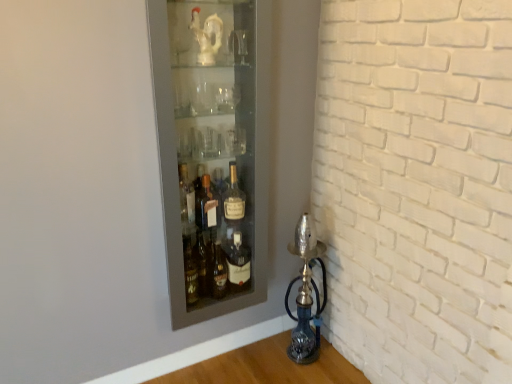
Question: Can you confirm if matte glass bottle at center is positioned to the left of matte glass cabinet at upper left?

Choices:
 (A) yes
 (B) no

Answer: (B)

Question: Is matte glass bottle at center positioned before matte glass cabinet at upper left?

Choices:
 (A) no
 (B) yes

Answer: (A)

Question: Does matte glass bottle at center have a lesser height compared to matte glass cabinet at upper left?

Choices:
 (A) yes
 (B) no

Answer: (A)

Question: Is matte glass cabinet at upper left a part of matte glass bottle at center?

Choices:
 (A) no
 (B) yes

Answer: (A)

Question: From the image's perspective, would you say matte glass bottle at center is positioned over matte glass cabinet at upper left?

Choices:
 (A) no
 (B) yes

Answer: (A)

Question: Is point (295, 230) closer or farther from the camera than point (237, 203)?

Choices:
 (A) farther
 (B) closer

Answer: (A)

Question: From a real-world perspective, relative to matte glass bottle at center, is blue glass oil lamp at lower right vertically above or below?

Choices:
 (A) above
 (B) below

Answer: (B)

Question: Considering the relative positions of blue glass oil lamp at lower right and matte glass bottle at center in the image provided, is blue glass oil lamp at lower right to the left or to the right of matte glass bottle at center?

Choices:
 (A) left
 (B) right

Answer: (B)

Question: Is blue glass oil lamp at lower right inside the boundaries of matte glass bottle at center, or outside?

Choices:
 (A) inside
 (B) outside

Answer: (B)

Question: Relative to blue glass oil lamp at lower right, is matte glass cabinet at upper left in front or behind?

Choices:
 (A) behind
 (B) front

Answer: (B)

Question: Considering the positions of matte glass cabinet at upper left and blue glass oil lamp at lower right in the image, is matte glass cabinet at upper left taller or shorter than blue glass oil lamp at lower right?

Choices:
 (A) tall
 (B) short

Answer: (A)

Question: Is matte glass cabinet at upper left wider or thinner than blue glass oil lamp at lower right?

Choices:
 (A) thin
 (B) wide

Answer: (A)

Question: In the image, is matte glass cabinet at upper left on the left side or the right side of blue glass oil lamp at lower right?

Choices:
 (A) left
 (B) right

Answer: (A)

Question: From the image's perspective, is matte glass bottle at center above or below matte glass cabinet at upper left?

Choices:
 (A) below
 (B) above

Answer: (A)

Question: In the image, is matte glass bottle at center positioned in front of or behind matte glass cabinet at upper left?

Choices:
 (A) front
 (B) behind

Answer: (B)